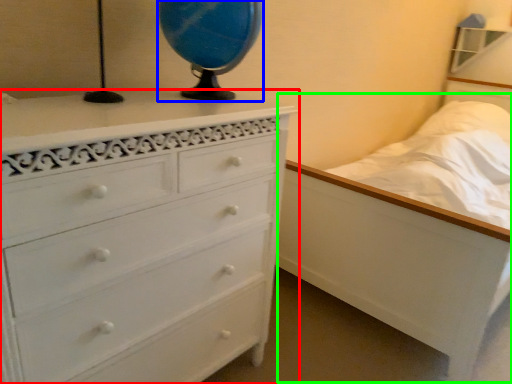
Question: Considering the real-world distances, which object is farthest from chest of drawers (highlighted by a red box)? table lamp (highlighted by a blue box) or bed (highlighted by a green box)?

Choices:
 (A) table lamp
 (B) bed

Answer: (B)